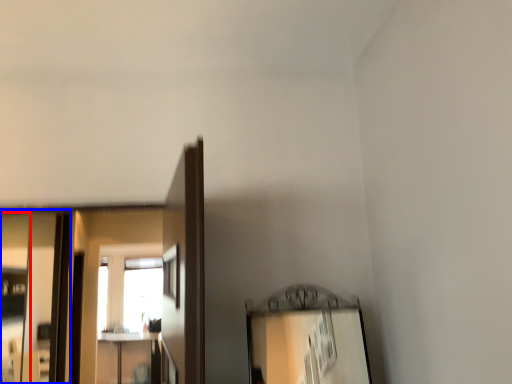
Question: Among these objects, which one is farthest to the camera, mirror (highlighted by a red box) or mirror (highlighted by a blue box)?

Choices:
 (A) mirror
 (B) mirror

Answer: (B)